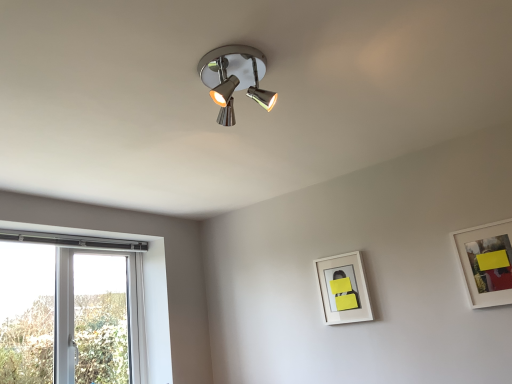
Question: From a real-world perspective, is white matte picture frame at lower right, the first picture frame viewed from the back, under white matte picture frame at upper right, positioned as the second picture frame in back-to-front order?

Choices:
 (A) no
 (B) yes

Answer: (A)

Question: Is white matte picture frame at lower right, the first picture frame viewed from the back, smaller than white matte picture frame at upper right, which ranks as the 1th picture frame in right-to-left order?

Choices:
 (A) no
 (B) yes

Answer: (B)

Question: Is white matte picture frame at lower right, the first picture frame viewed from the back, not inside white matte picture frame at upper right, positioned as the second picture frame in back-to-front order?

Choices:
 (A) no
 (B) yes

Answer: (B)

Question: Would you say white matte picture frame at lower right, arranged as the first picture frame when viewed from the left, is a long distance from white matte picture frame at upper right, which ranks as the 1th picture frame in right-to-left order?

Choices:
 (A) no
 (B) yes

Answer: (A)

Question: Is white matte picture frame at lower right, the first picture frame viewed from the back, oriented away from white matte picture frame at upper right, positioned as the second picture frame in back-to-front order?

Choices:
 (A) no
 (B) yes

Answer: (A)

Question: Does white matte picture frame at lower right, the first picture frame viewed from the back, have a greater width compared to white matte picture frame at upper right, the 1th picture frame in the front-to-back sequence?

Choices:
 (A) yes
 (B) no

Answer: (B)

Question: From the image's perspective, is white matte picture frame at upper right, which is counted as the second picture frame, starting from the left, on white matte picture frame at lower right, the 2th picture frame viewed from the front?

Choices:
 (A) no
 (B) yes

Answer: (B)

Question: Can you confirm if white matte picture frame at upper right, which ranks as the 1th picture frame in right-to-left order, is positioned to the left of white matte picture frame at lower right, arranged as the first picture frame when viewed from the left?

Choices:
 (A) no
 (B) yes

Answer: (A)

Question: Is white matte picture frame at upper right, which ranks as the 1th picture frame in right-to-left order, facing towards white matte picture frame at lower right, arranged as the first picture frame when viewed from the left?

Choices:
 (A) yes
 (B) no

Answer: (B)

Question: Can white matte picture frame at lower right, positioned as the 2th picture frame in right-to-left order, be found inside white matte picture frame at upper right, positioned as the second picture frame in back-to-front order?

Choices:
 (A) yes
 (B) no

Answer: (B)

Question: Is the position of white matte picture frame at upper right, positioned as the second picture frame in back-to-front order, more distant than that of white matte picture frame at lower right, the first picture frame viewed from the back?

Choices:
 (A) no
 (B) yes

Answer: (A)

Question: Can you confirm if white matte picture frame at upper right, which ranks as the 1th picture frame in right-to-left order, is smaller than white matte picture frame at lower right, arranged as the first picture frame when viewed from the left?

Choices:
 (A) no
 (B) yes

Answer: (A)

Question: Is white matte picture frame at lower right, the 2th picture frame viewed from the front, in front of or behind white matte picture frame at upper right, positioned as the second picture frame in back-to-front order, in the image?

Choices:
 (A) behind
 (B) front

Answer: (A)